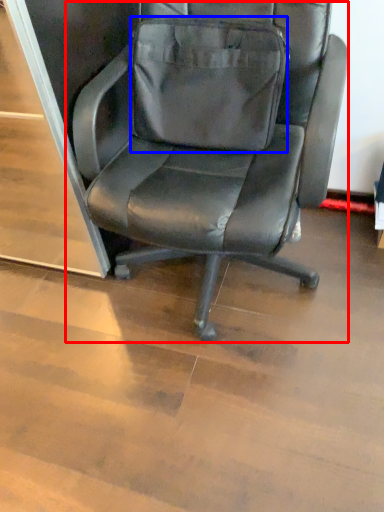
Question: Among these objects, which one is farthest to the camera, chair (highlighted by a red box) or messenger bag (highlighted by a blue box)?

Choices:
 (A) chair
 (B) messenger bag

Answer: (B)